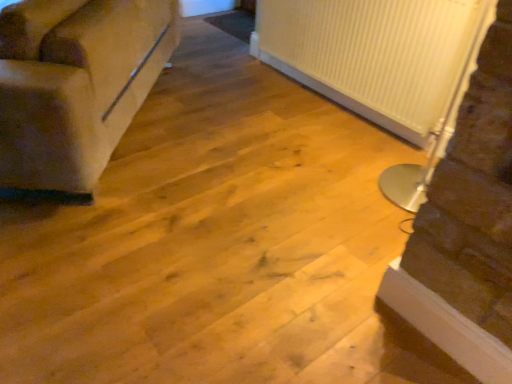
Question: Considering the relative sizes of white ribbed radiator at right and white ribbed radiator at upper right in the image provided, is white ribbed radiator at right bigger than white ribbed radiator at upper right?

Choices:
 (A) yes
 (B) no

Answer: (A)

Question: From the image's perspective, is white ribbed radiator at right on top of white ribbed radiator at upper right?

Choices:
 (A) no
 (B) yes

Answer: (A)

Question: Is white ribbed radiator at right to the left of white ribbed radiator at upper right from the viewer's perspective?

Choices:
 (A) no
 (B) yes

Answer: (A)

Question: Does white ribbed radiator at right have a greater width compared to white ribbed radiator at upper right?

Choices:
 (A) yes
 (B) no

Answer: (A)

Question: Considering the relative sizes of white ribbed radiator at right and white ribbed radiator at upper right in the image provided, is white ribbed radiator at right shorter than white ribbed radiator at upper right?

Choices:
 (A) no
 (B) yes

Answer: (A)

Question: In the image, is white ribbed radiator at right positioned in front of or behind white ribbed radiator at upper right?

Choices:
 (A) behind
 (B) front

Answer: (B)

Question: Is point (472, 319) closer or farther from the camera than point (414, 132)?

Choices:
 (A) farther
 (B) closer

Answer: (B)

Question: In terms of size, does white ribbed radiator at right appear bigger or smaller than white ribbed radiator at upper right?

Choices:
 (A) big
 (B) small

Answer: (A)

Question: In terms of height, does white ribbed radiator at right look taller or shorter compared to white ribbed radiator at upper right?

Choices:
 (A) tall
 (B) short

Answer: (A)

Question: Is white ribbed radiator at upper right in front of or behind white ribbed radiator at right in the image?

Choices:
 (A) behind
 (B) front

Answer: (A)

Question: Is white ribbed radiator at upper right taller or shorter than white ribbed radiator at right?

Choices:
 (A) tall
 (B) short

Answer: (B)

Question: Which is correct: white ribbed radiator at upper right is inside white ribbed radiator at right, or outside of it?

Choices:
 (A) outside
 (B) inside

Answer: (A)

Question: From the image's perspective, relative to white ribbed radiator at right, is white ribbed radiator at upper right above or below?

Choices:
 (A) below
 (B) above

Answer: (B)

Question: From a real-world perspective, is suede-like beige couch at left positioned above or below white ribbed radiator at right?

Choices:
 (A) below
 (B) above

Answer: (A)

Question: In the image, is suede-like beige couch at left positioned in front of or behind white ribbed radiator at right?

Choices:
 (A) behind
 (B) front

Answer: (A)